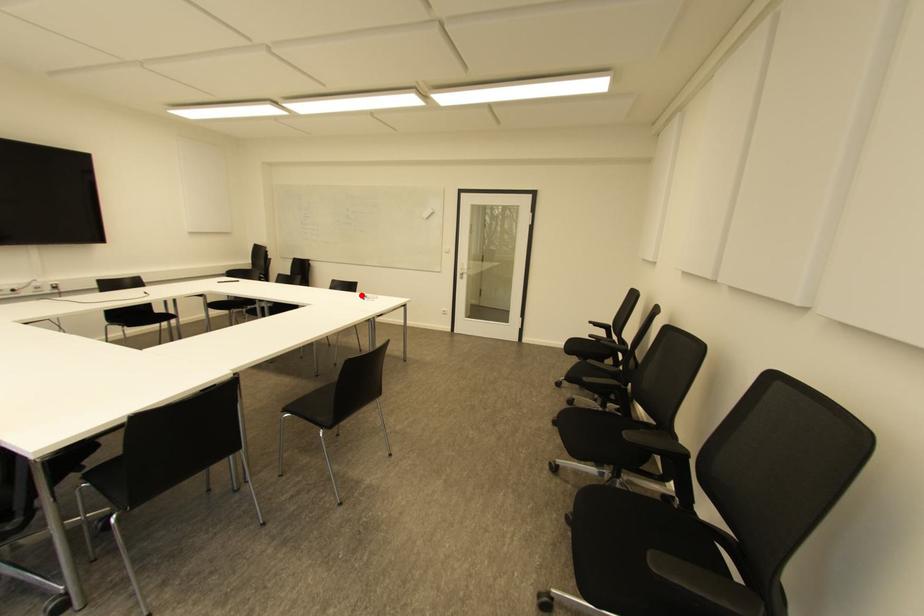
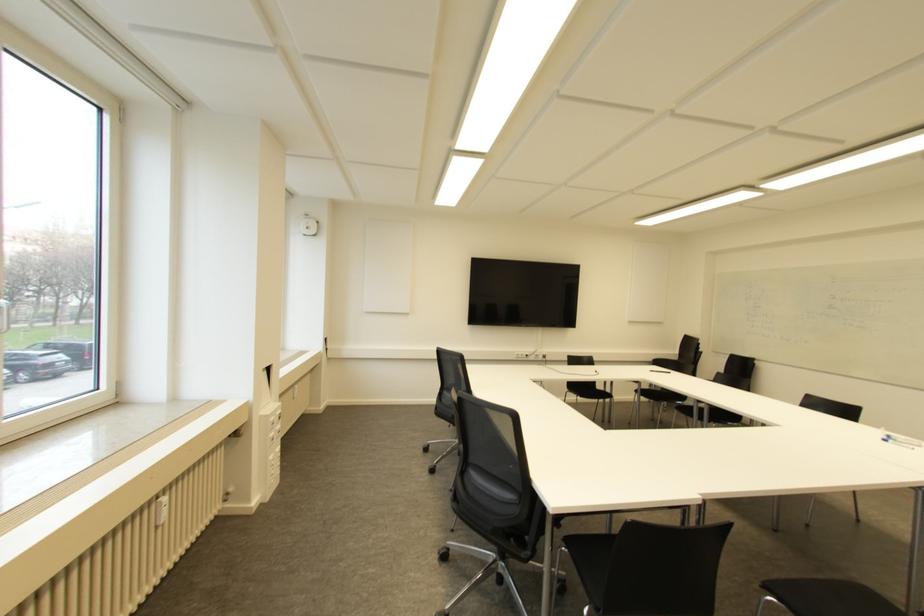
Question: I am providing you with two images of the same scene from different viewpoints. In image1, a red point is highlighted. Considering the same 3D point in image2, which of the following is correct?

Choices:
 (A) It is closer
 (B) It is farther

Answer: (A)